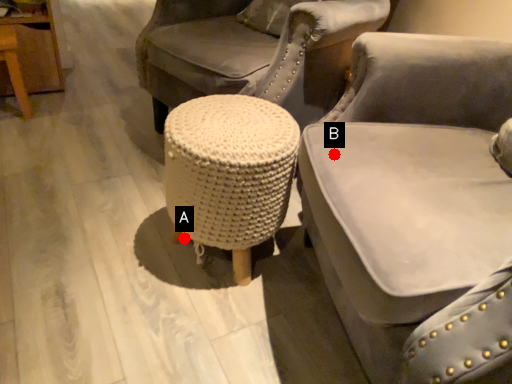
Question: Two points are circled on the image, labeled by A and B beside each circle. Among these points, which one is farthest from the camera?

Choices:
 (A) A is further
 (B) B is further

Answer: (A)